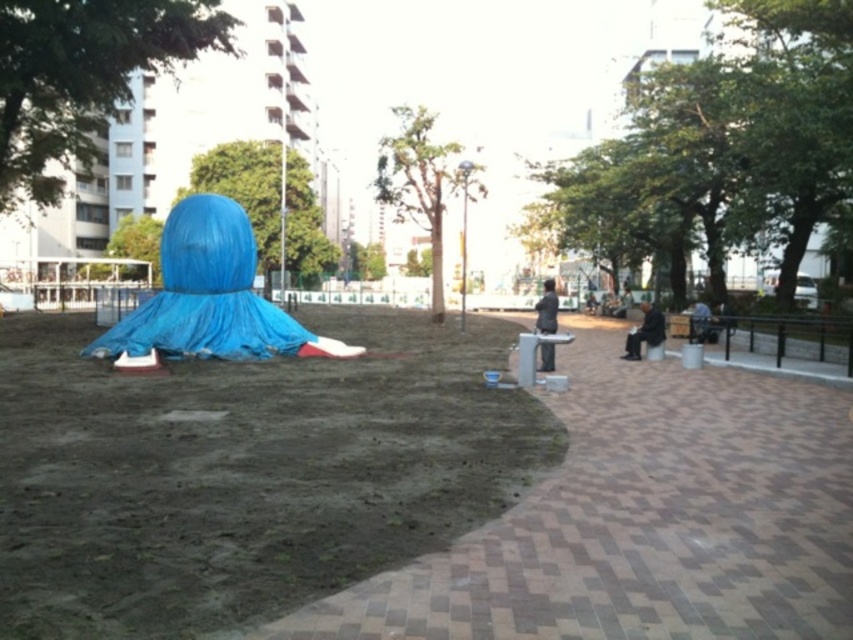
Who is more distant from viewer, (277,486) or (694,323)?

The point (694,323) is more distant.

Is dirt field at left further to the viewer compared to gray fabric bag at right?

No.

Image resolution: width=853 pixels, height=640 pixels. I want to click on dirt field at left, so click(x=244, y=470).

The image size is (853, 640). I want to click on dirt field at left, so click(x=244, y=470).

Does blue tarpaulin sculpture at center have a greater height compared to gray fabric bag at right?

Yes, blue tarpaulin sculpture at center is taller than gray fabric bag at right.

Between blue tarpaulin sculpture at center and gray fabric bag at right, which one appears on the left side from the viewer's perspective?

blue tarpaulin sculpture at center is more to the left.

Does point (178, 248) lie behind point (701, 317)?

No, (178, 248) is closer to viewer.

At what (x,y) coordinates should I click in order to perform the action: click on blue tarpaulin sculpture at center. Please return your answer as a coordinate pair (x, y). The width and height of the screenshot is (853, 640). Looking at the image, I should click on (210, 296).

Which is above, blue tarpaulin sculpture at center or dark gray fabric jacket at center-right?

Positioned higher is dark gray fabric jacket at center-right.

Between point (225, 237) and point (538, 326), which one is positioned in front?

Point (538, 326) is more forward.

At what (x,y) coordinates should I click in order to perform the action: click on blue tarpaulin sculpture at center. Please return your answer as a coordinate pair (x, y). Image resolution: width=853 pixels, height=640 pixels. Looking at the image, I should click on (210, 296).